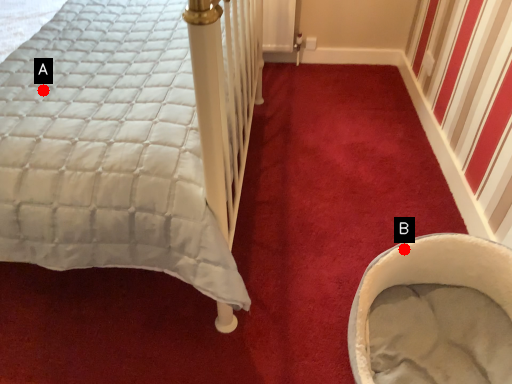
Question: Two points are circled on the image, labeled by A and B beside each circle. Which point appears closest to the camera in this image?

Choices:
 (A) A is closer
 (B) B is closer

Answer: (A)